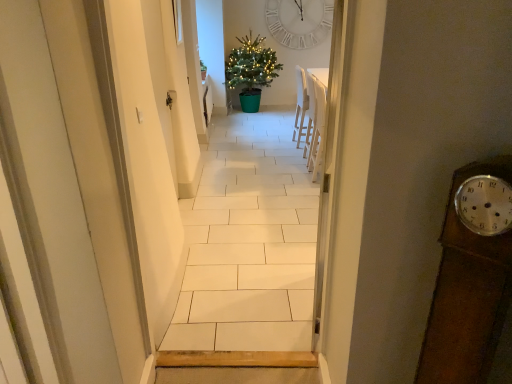
Question: Is white tile floor at center not inside white plastic chair at upper right?

Choices:
 (A) yes
 (B) no

Answer: (A)

Question: Does white tile floor at center have a lesser height compared to white plastic chair at upper right?

Choices:
 (A) no
 (B) yes

Answer: (A)

Question: Can you confirm if white tile floor at center is positioned to the left of white plastic chair at upper right?

Choices:
 (A) no
 (B) yes

Answer: (B)

Question: Is there a large distance between white tile floor at center and white plastic chair at upper right?

Choices:
 (A) yes
 (B) no

Answer: (B)

Question: From the image's perspective, is white tile floor at center beneath white plastic chair at upper right?

Choices:
 (A) no
 (B) yes

Answer: (B)

Question: Considering the relative positions of white tile floor at center and white plastic chair at upper right in the image provided, is white tile floor at center in front of white plastic chair at upper right?

Choices:
 (A) yes
 (B) no

Answer: (A)

Question: Is green plastic christmas tree at center at the right side of green glossy plant at center?

Choices:
 (A) no
 (B) yes

Answer: (B)

Question: Can you confirm if green plastic christmas tree at center is shorter than green glossy plant at center?

Choices:
 (A) yes
 (B) no

Answer: (B)

Question: Does green plastic christmas tree at center have a lesser width compared to green glossy plant at center?

Choices:
 (A) no
 (B) yes

Answer: (A)

Question: Is green plastic christmas tree at center to the left of green glossy plant at center from the viewer's perspective?

Choices:
 (A) no
 (B) yes

Answer: (A)

Question: Are green plastic christmas tree at center and green glossy plant at center making contact?

Choices:
 (A) yes
 (B) no

Answer: (B)

Question: Is green plastic christmas tree at center far from green glossy plant at center?

Choices:
 (A) no
 (B) yes

Answer: (A)

Question: Is white tile floor at center not within white wooden clock at upper center?

Choices:
 (A) yes
 (B) no

Answer: (A)